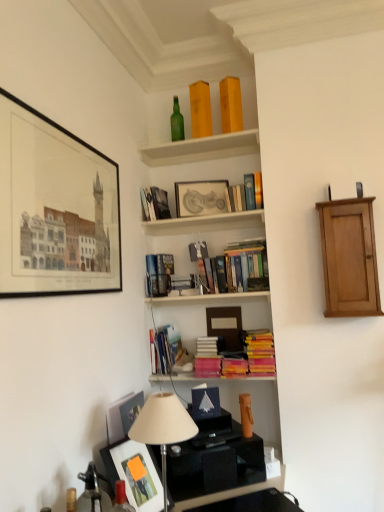
Identify the location of hardcover book at upper center, placed as the third book when sorted from top to bottom. (247, 193).

The height and width of the screenshot is (512, 384). Describe the element at coordinates (247, 193) in the screenshot. I see `hardcover book at upper center, placed as the eighth book when sorted from bottom to top` at that location.

How much space does matte silver picture frame at center, the second picture frame positioned from the left, occupy vertically?

It is 9.16 inches.

What is the approximate width of hardcover book at center, which is the 4th book in bottom-to-top order?

hardcover book at center, which is the 4th book in bottom-to-top order, is 11.82 centimeters wide.

What do you see at coordinates (159, 274) in the screenshot? Image resolution: width=384 pixels, height=512 pixels. I see `hardcover book at center, which is the 7th book from top to bottom` at bounding box center [159, 274].

Measure the distance between green glass bottle at upper center and camera.

The distance of green glass bottle at upper center from camera is 2.38 meters.

Measure the distance between matte black picture frame at upper left, the 1th picture frame viewed from the left, and camera.

The depth of matte black picture frame at upper left, the 1th picture frame viewed from the left, is 1.22 meters.

Locate an element on the screen. This screenshot has height=512, width=384. hardcover book at upper center, placed as the third book when sorted from top to bottom is located at coordinates (247, 193).

From a real-world perspective, which is physically above, matte glass bottles at upper center, positioned as the first shelf in top-to-bottom order, or black glossy table at lower center?

matte glass bottles at upper center, positioned as the first shelf in top-to-bottom order, from a real-world perspective.

Can you confirm if matte glass bottles at upper center, the 2th shelf from the bottom, is shorter than black glossy table at lower center?

Yes, matte glass bottles at upper center, the 2th shelf from the bottom, is shorter than black glossy table at lower center.

Considering the relative positions of matte glass bottles at upper center, positioned as the first shelf in top-to-bottom order, and black glossy table at lower center in the image provided, is matte glass bottles at upper center, positioned as the first shelf in top-to-bottom order, to the right of black glossy table at lower center from the viewer's perspective?

In fact, matte glass bottles at upper center, positioned as the first shelf in top-to-bottom order, is to the left of black glossy table at lower center.

Would you consider matte glass bottles at upper center, the 2th shelf from the bottom, to be distant from black glossy table at lower center?

Yes.

Who is bigger, hardcover book at upper center, which is the 7th book in bottom-to-top order, or hardcover book at center, which is the 7th book from top to bottom?

hardcover book at upper center, which is the 7th book in bottom-to-top order.

Is point (150, 217) more distant than point (167, 254)?

No.

Looking at their sizes, would you say hardcover book at upper center, the fourth book positioned from the top, is wider or thinner than hardcover book at center, which is the 4th book in bottom-to-top order?

In the image, hardcover book at upper center, the fourth book positioned from the top, appears to be wider than hardcover book at center, which is the 4th book in bottom-to-top order.

Considering the points (180, 120) and (193, 198), which point is in front, point (180, 120) or point (193, 198)?

The point (193, 198) is closer.

Who is smaller, green glass bottle at upper center or matte silver picture frame at center, acting as the first picture frame starting from the right?

matte silver picture frame at center, acting as the first picture frame starting from the right.

Is green glass bottle at upper center closer to camera compared to matte silver picture frame at center, the 2th picture frame when ordered from front to back?

No, green glass bottle at upper center is behind matte silver picture frame at center, the 2th picture frame when ordered from front to back.

From a real-world perspective, is green glass bottle at upper center physically above matte silver picture frame at center, acting as the first picture frame starting from the right?

Yes.

Is matte black picture frame at upper left, the second picture frame when ordered from right to left, shorter than green glass bottle at upper center?

Incorrect, the height of matte black picture frame at upper left, the second picture frame when ordered from right to left, does not fall short of that of green glass bottle at upper center.

Would you say matte black picture frame at upper left, the second picture frame when ordered from right to left, is outside green glass bottle at upper center?

Indeed, matte black picture frame at upper left, the second picture frame when ordered from right to left, is completely outside green glass bottle at upper center.

Which object is thinner, hardcover books at center, placed as the 1th book when sorted from bottom to top, or yellow matte stack of books at center, which ranks as the 8th book in top-to-bottom order?

Thinner between the two is hardcover books at center, placed as the 1th book when sorted from bottom to top.

You are a GUI agent. You are given a task and a screenshot of the screen. Output one action in this format:
    pyautogui.click(x=<x>, y=<y>)
    Task: Click on the 2nd book behind when counting from the yellow matte stack of books at center, the 3th book when ordered from bottom to top
    Image resolution: width=384 pixels, height=512 pixels.
    Given the screenshot: What is the action you would take?
    207,357

From a real-world perspective, relative to yellow matte stack of books at center, which ranks as the 8th book in top-to-bottom order, is hardcover books at center, placed as the 1th book when sorted from bottom to top, vertically above or below?

hardcover books at center, placed as the 1th book when sorted from bottom to top, is situated lower than yellow matte stack of books at center, which ranks as the 8th book in top-to-bottom order, in the real world.

Is hardcover books at center, placed as the tenth book when sorted from top to bottom, looking in the opposite direction of black glossy table at lower center?

hardcover books at center, placed as the tenth book when sorted from top to bottom, does not have its back to black glossy table at lower center.

What's the angular difference between hardcover books at center, placed as the tenth book when sorted from top to bottom, and black glossy table at lower center's facing directions?

The angular difference between hardcover books at center, placed as the tenth book when sorted from top to bottom, and black glossy table at lower center is 39.4 degrees.

From a real-world perspective, which book is the 1st one above the black glossy table at lower center? Please provide its 2D coordinates.

[(207, 357)]

From a real-world perspective, does hardcover books at center, placed as the 1th book when sorted from bottom to top, sit lower than black glossy table at lower center?

Actually, hardcover books at center, placed as the 1th book when sorted from bottom to top, is physically above black glossy table at lower center in the real world.

How different are the orientations of green glass bottle at upper center and wooden books at center, the second shelf in the top-to-bottom sequence, in degrees?

The facing directions of green glass bottle at upper center and wooden books at center, the second shelf in the top-to-bottom sequence, are 13.8 degrees apart.

Considering the positions of points (175, 140) and (152, 231), is point (175, 140) closer to camera compared to point (152, 231)?

Yes, point (175, 140) is closer to viewer.

This screenshot has width=384, height=512. Identify the location of bottle behind the wooden books at center, which is counted as the 1th shelf, starting from the bottom. (177, 122).

Which object is positioned more to the left, green glass bottle at upper center or wooden books at center, the second shelf in the top-to-bottom sequence?

green glass bottle at upper center.

This screenshot has width=384, height=512. I want to click on table below the matte glass bottles at upper center, positioned as the first shelf in top-to-bottom order (from a real-world perspective), so click(x=215, y=461).

The height and width of the screenshot is (512, 384). Identify the location of book that is the 3rd one when counting downward from the hardcover book at upper center, which is the 7th book in bottom-to-top order (from the image's perspective). (159, 274).

Estimate the real-world distances between objects in this image. Which object is further from black glossy table at lower center, beige fabric lampshade at lower center or wooden books at center, which is counted as the 1th shelf, starting from the bottom?

The object further to black glossy table at lower center is wooden books at center, which is counted as the 1th shelf, starting from the bottom.

From the image, which object appears to be farther from light brown wood cabinet at right, green glass bottle at upper center or matte yellow book at upper center, which ranks as the tenth book in bottom-to-top order?

The object further to light brown wood cabinet at right is green glass bottle at upper center.

Based on their spatial positions, is hardcover book at upper center, the fourth book positioned from the top, or matte black picture frame at upper left, which ranks as the 1th picture frame in front-to-back order, further from hardcover books at center, which is the 6th book from top to bottom?

matte black picture frame at upper left, which ranks as the 1th picture frame in front-to-back order, lies further to hardcover books at center, which is the 6th book from top to bottom, than the other object.

Considering their positions, is beige fabric lampshade at lower center positioned further to black glossy table at lower center than hardcover books at center, the fifth book from the top?

The object further to black glossy table at lower center is hardcover books at center, the fifth book from the top.

Looking at the image, which one is located closer to matte yellow book at upper center, placed as the 1th book when sorted from top to bottom, blue matte paper at center or hardcover books at center, which is the sixth book from bottom to top?

Among the two, hardcover books at center, which is the sixth book from bottom to top, is located nearer to matte yellow book at upper center, placed as the 1th book when sorted from top to bottom.

Based on the photo, based on their spatial positions, is beige fabric lampshade at lower center or matte glass bottles at upper center, the 2th shelf from the bottom, further from hardcover books at center, placed as the 1th book when sorted from bottom to top?

matte glass bottles at upper center, the 2th shelf from the bottom, is positioned further to the anchor hardcover books at center, placed as the 1th book when sorted from bottom to top.

Considering their positions, is green glass bottle at upper center positioned closer to beige fabric lampshade at lower center than blue matte paper at center?

Among the two, blue matte paper at center is located nearer to beige fabric lampshade at lower center.

Which object lies nearer to the anchor point matte yellow book at upper center, the ninth book when ordered from bottom to top, hardcover books at center, the fifth book from the top, or matte black picture frame at upper left, the second picture frame when ordered from right to left?

hardcover books at center, the fifth book from the top, is closer to matte yellow book at upper center, the ninth book when ordered from bottom to top.

Image resolution: width=384 pixels, height=512 pixels. What are the coordinates of `bottle between matte yellow book at upper center, the ninth book when ordered from bottom to top, and black glossy table at lower center from top to bottom` in the screenshot? It's located at (177, 122).

Locate an element on the screen. This screenshot has width=384, height=512. bottle between matte yellow book at upper center, which ranks as the tenth book in bottom-to-top order, and hardcover books at center, which ranks as the 2th book in bottom-to-top order, in the vertical direction is located at coordinates (177, 122).

You are a GUI agent. You are given a task and a screenshot of the screen. Output one action in this format:
    pyautogui.click(x=<x>, y=<y>)
    Task: Click on the shelf between hardcover book at upper center, the fourth book positioned from the top, and hardcover books at center, the fifth book positioned from the bottom, in the vertical direction
    The width and height of the screenshot is (384, 512).
    Given the screenshot: What is the action you would take?
    pyautogui.click(x=205, y=223)

Locate an element on the screen. cabinetry between matte yellow book at upper center, which ranks as the tenth book in bottom-to-top order, and beige fabric lampshade at lower center vertically is located at coordinates (349, 258).